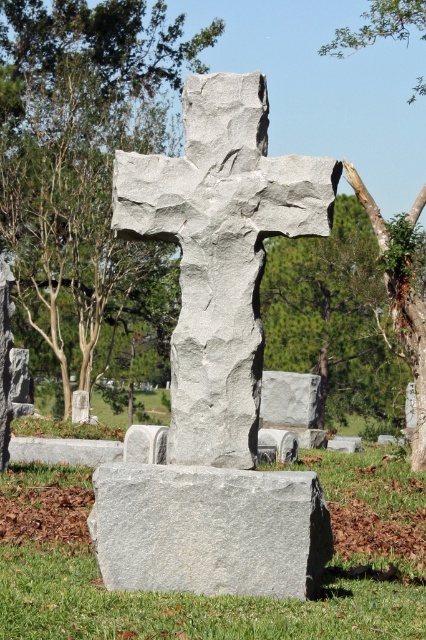
Is gray stone slab at center below gray granite gravestone at lower center?

Indeed, gray stone slab at center is positioned under gray granite gravestone at lower center.

Does point (402, 474) come closer to viewer compared to point (244, 515)?

No, it is not.

Between point (340, 499) and point (310, 496), which one is positioned in front?

Point (310, 496) is in front.

Identify the location of gray stone slab at center. This screenshot has height=640, width=426. (222, 595).

Is brown leafy tree at center in front of green leafy tree at upper center?

No, it is not.

Is brown leafy tree at center to the left of green leafy tree at upper center from the viewer's perspective?

Correct, you'll find brown leafy tree at center to the left of green leafy tree at upper center.

Where is `brown leafy tree at center`? The width and height of the screenshot is (426, 640). brown leafy tree at center is located at coordinates (80, 152).

Where is `gray stone cross at center`? The height and width of the screenshot is (640, 426). gray stone cross at center is located at coordinates (221, 252).

Can you confirm if gray stone cross at center is wider than green leafy tree at center?

No.

The width and height of the screenshot is (426, 640). Describe the element at coordinates (221, 252) in the screenshot. I see `gray stone cross at center` at that location.

Locate an element on the screen. This screenshot has height=640, width=426. gray stone cross at center is located at coordinates (221, 252).